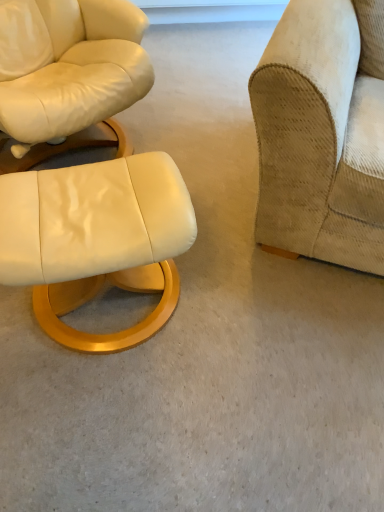
Identify the location of vacant area situated to the left side of beige corduroy couch at right. The height and width of the screenshot is (512, 384). (198, 157).